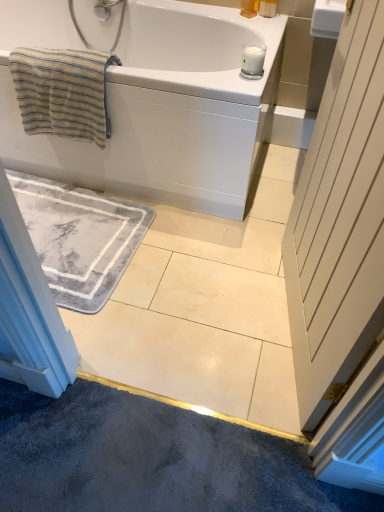
Question: Is beige striped towel at upper left aimed at matte plastic soap at upper right, placed as the 1th toiletry when sorted from right to left?

Choices:
 (A) no
 (B) yes

Answer: (A)

Question: From the image's perspective, is beige striped towel at upper left over matte plastic soap at upper right, placed as the 1th toiletry when sorted from right to left?

Choices:
 (A) yes
 (B) no

Answer: (B)

Question: Is beige striped towel at upper left wider than matte plastic soap at upper right, placed as the 1th toiletry when sorted from right to left?

Choices:
 (A) yes
 (B) no

Answer: (A)

Question: Is beige striped towel at upper left at the left side of matte plastic soap at upper right, placed as the 1th toiletry when sorted from right to left?

Choices:
 (A) yes
 (B) no

Answer: (A)

Question: Does beige striped towel at upper left have a greater height compared to matte plastic soap at upper right, the second toiletry in the left-to-right sequence?

Choices:
 (A) no
 (B) yes

Answer: (B)

Question: Is matte yellow soap at upper center, acting as the first toiletry starting from the left, taller or shorter than white wooden door at right?

Choices:
 (A) tall
 (B) short

Answer: (B)

Question: Is matte yellow soap at upper center, acting as the first toiletry starting from the left, spatially inside white wooden door at right, or outside of it?

Choices:
 (A) outside
 (B) inside

Answer: (A)

Question: Considering the positions of point (248, 5) and point (354, 87), is point (248, 5) closer or farther from the camera than point (354, 87)?

Choices:
 (A) closer
 (B) farther

Answer: (B)

Question: Considering their positions, is matte yellow soap at upper center, the second toiletry viewed from the right, located in front of or behind white wooden door at right?

Choices:
 (A) front
 (B) behind

Answer: (B)

Question: Is matte plastic soap at upper right, the second toiletry in the left-to-right sequence, bigger or smaller than matte yellow soap at upper center, the second toiletry viewed from the right?

Choices:
 (A) small
 (B) big

Answer: (B)

Question: Is matte plastic soap at upper right, placed as the 1th toiletry when sorted from right to left, spatially inside matte yellow soap at upper center, the second toiletry viewed from the right, or outside of it?

Choices:
 (A) inside
 (B) outside

Answer: (B)

Question: In the image, is matte plastic soap at upper right, placed as the 1th toiletry when sorted from right to left, positioned in front of or behind matte yellow soap at upper center, the second toiletry viewed from the right?

Choices:
 (A) behind
 (B) front

Answer: (B)

Question: Based on their positions, is matte plastic soap at upper right, placed as the 1th toiletry when sorted from right to left, located to the left or right of matte yellow soap at upper center, the second toiletry viewed from the right?

Choices:
 (A) right
 (B) left

Answer: (A)

Question: Considering the relative positions of white wooden door at right and matte yellow soap at upper center, acting as the first toiletry starting from the left, in the image provided, is white wooden door at right to the left or to the right of matte yellow soap at upper center, acting as the first toiletry starting from the left,?

Choices:
 (A) left
 (B) right

Answer: (B)

Question: From the image's perspective, relative to matte yellow soap at upper center, acting as the first toiletry starting from the left, is white wooden door at right above or below?

Choices:
 (A) below
 (B) above

Answer: (A)